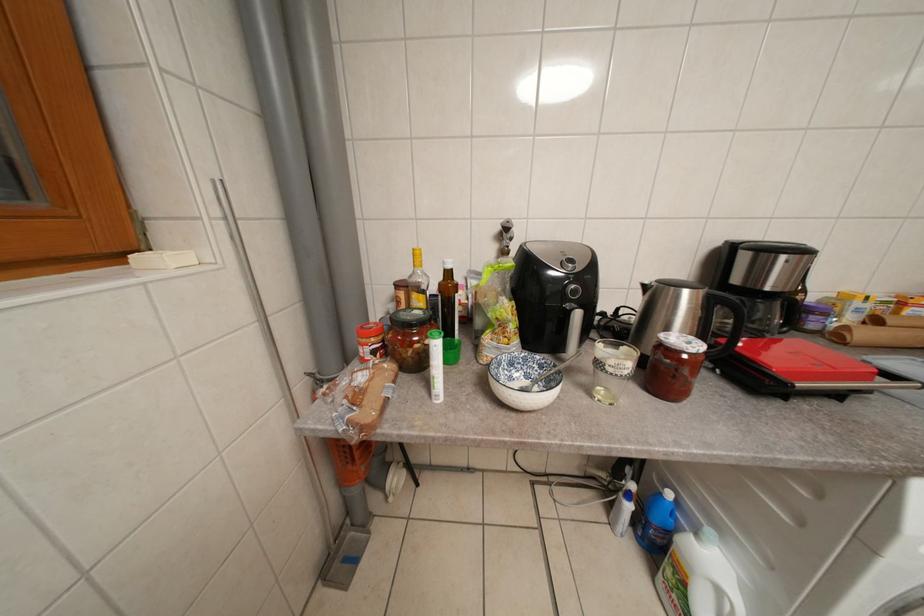
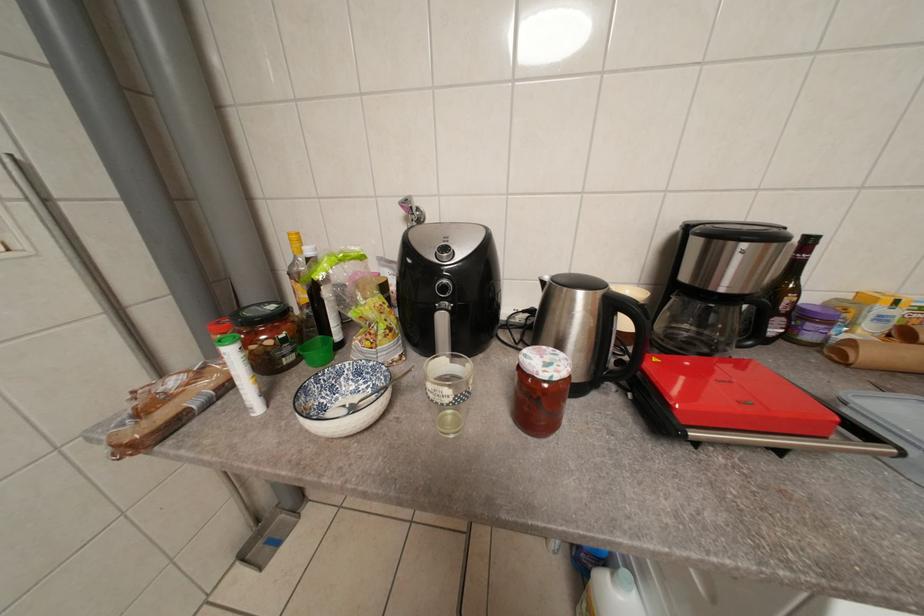
Question: Which direction would the cameraman need to move to produce the second image? Reply with the corresponding letter.

Choices:
 (A) Left
 (B) Right
 (C) Forward
 (D) Backward

Answer: (B)